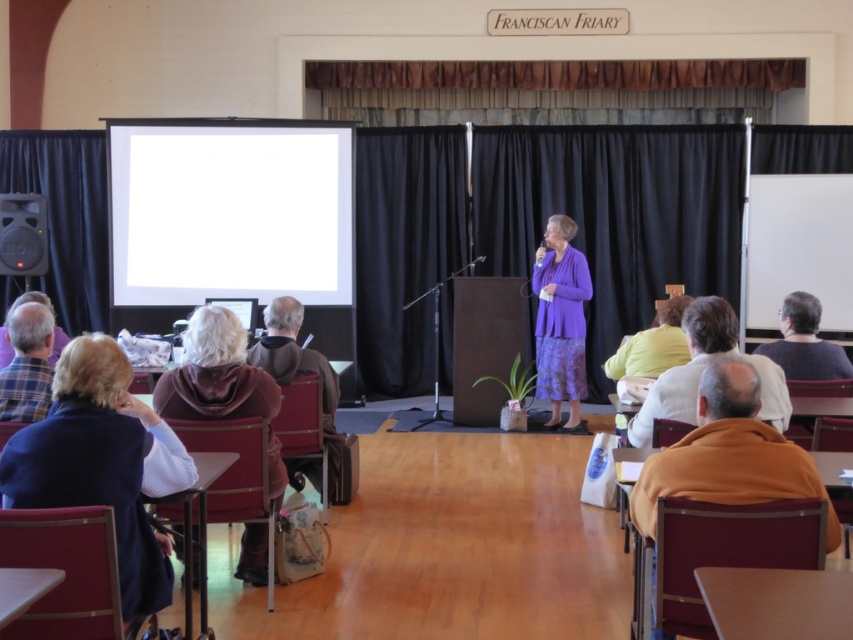
Question: Can you confirm if white glossy projection screen at upper left is positioned to the left of orange fleece at lower right?

Choices:
 (A) yes
 (B) no

Answer: (A)

Question: Which object appears closest to the camera in this image?

Choices:
 (A) plaid fabric shirt at left
 (B) dark blue sweater at lower left
 (C) brown leather jacket at lower right

Answer: (B)

Question: Estimate the real-world distances between objects in this image. Which object is farther from the plaid fabric shirt at left?

Choices:
 (A) brown leather jacket at lower right
 (B) brown leather jacket at lower left
 (C) purple fabric dress at center

Answer: (C)

Question: Can you confirm if yellow fabric at center is thinner than plaid shirt at left?

Choices:
 (A) no
 (B) yes

Answer: (B)

Question: Which of these objects is positioned farthest from the dark blue sweater at lower left?

Choices:
 (A) white glossy projection screen at upper left
 (B) plaid shirt at left
 (C) brown leather jacket at lower right

Answer: (A)

Question: Does white glossy projection screen at upper left have a smaller size compared to orange fleece at lower right?

Choices:
 (A) yes
 (B) no

Answer: (B)